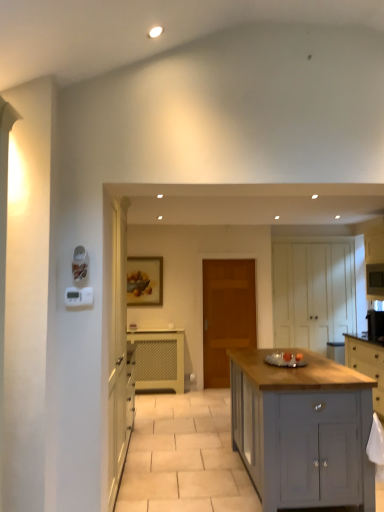
The image size is (384, 512). Describe the element at coordinates (374, 262) in the screenshot. I see `white matte cabinet at right, which ranks as the third cabinetry in front-to-back order` at that location.

You are a GUI agent. You are given a task and a screenshot of the screen. Output one action in this format:
    pyautogui.click(x=<x>, y=<y>)
    Task: Click on the white matte cabinet at right, the third cabinetry positioned from the back
    This screenshot has width=384, height=512.
    Given the screenshot: What is the action you would take?
    pyautogui.click(x=374, y=262)

Locate an element on the screen. beige mesh radiator at center, the fourth cabinetry from the front is located at coordinates (158, 360).

Consider the image. Measure the distance between light gray wood cabinet at right, the fourth cabinetry in the back-to-front sequence, and camera.

The distance of light gray wood cabinet at right, the fourth cabinetry in the back-to-front sequence, from camera is 4.67 meters.

Measure the distance between point (347, 490) and camera.

2.83 meters.

This screenshot has height=512, width=384. Describe the element at coordinates (375, 280) in the screenshot. I see `white glossy microwave at upper right` at that location.

Identify the location of white matte cabinet at right, which ranks as the third cabinetry in front-to-back order. (374, 262).

Does white matte cabinet at right, the fifth cabinetry in the left-to-right sequence, touch beige mesh radiator at center, the fifth cabinetry positioned from the right?

No.

Is white matte cabinet at right, which ranks as the 1th cabinetry in right-to-left order, positioned before beige mesh radiator at center, the fourth cabinetry from the front?

Yes, the depth of white matte cabinet at right, which ranks as the 1th cabinetry in right-to-left order, is less than that of beige mesh radiator at center, the fourth cabinetry from the front.

In the scene shown: Who is taller, white matte cabinet at right, the third cabinetry positioned from the back, or beige mesh radiator at center, which is the 2th cabinetry in back-to-front order?

With more height is white matte cabinet at right, the third cabinetry positioned from the back.

From a real-world perspective, which object rests below the other?

From a 3D spatial view, beige mesh radiator at center, the fifth cabinetry positioned from the right, is below.

Do you think white matte cabinet at right, which ranks as the 1th cabinetry in right-to-left order, is within matte gray cabinet at center, which is counted as the first cabinetry, starting from the front, or outside of it?

white matte cabinet at right, which ranks as the 1th cabinetry in right-to-left order, lies outside matte gray cabinet at center, which is counted as the first cabinetry, starting from the front.

Can you confirm if white matte cabinet at right, the third cabinetry positioned from the back, is shorter than matte gray cabinet at center, the 2th cabinetry when ordered from left to right?

In fact, white matte cabinet at right, the third cabinetry positioned from the back, may be taller than matte gray cabinet at center, the 2th cabinetry when ordered from left to right.

Considering the points (381, 247) and (256, 423), which point is in front, point (381, 247) or point (256, 423)?

The point (256, 423) is closer.

Is beige mesh radiator at center, the fourth cabinetry from the front, facing towards white wood cabinet at center, marked as the third cabinetry in a right-to-left arrangement?

No, beige mesh radiator at center, the fourth cabinetry from the front, is not oriented towards white wood cabinet at center, marked as the third cabinetry in a right-to-left arrangement.

Considering the relative sizes of beige mesh radiator at center, the fifth cabinetry positioned from the right, and white wood cabinet at center, arranged as the fifth cabinetry when viewed from the front, in the image provided, is beige mesh radiator at center, the fifth cabinetry positioned from the right, thinner than white wood cabinet at center, arranged as the fifth cabinetry when viewed from the front,?

Yes, beige mesh radiator at center, the fifth cabinetry positioned from the right, is thinner than white wood cabinet at center, arranged as the fifth cabinetry when viewed from the front.

Is beige mesh radiator at center, the fourth cabinetry from the front, inside the boundaries of white wood cabinet at center, marked as the third cabinetry in a right-to-left arrangement, or outside?

beige mesh radiator at center, the fourth cabinetry from the front, is spatially situated outside white wood cabinet at center, marked as the third cabinetry in a right-to-left arrangement.

Is beige mesh radiator at center, the fifth cabinetry positioned from the right, next to white wood cabinet at center, which is the 3th cabinetry from left to right?

No, beige mesh radiator at center, the fifth cabinetry positioned from the right, is not with white wood cabinet at center, which is the 3th cabinetry from left to right.

Can you tell me how much light gray wood cabinet at right, which is the fourth cabinetry from left to right, and wooden door at center differ in facing direction?

There is a 88.8-degree angle between the facing directions of light gray wood cabinet at right, which is the fourth cabinetry from left to right, and wooden door at center.

Considering the sizes of objects light gray wood cabinet at right, the 2th cabinetry positioned from the right, and wooden door at center in the image provided, who is shorter, light gray wood cabinet at right, the 2th cabinetry positioned from the right, or wooden door at center?

light gray wood cabinet at right, the 2th cabinetry positioned from the right.

Which is nearer, (376, 370) or (210, 300)?

The point (376, 370) is more forward.

Is light gray wood cabinet at right, placed as the second cabinetry when sorted from front to back, oriented away from wooden door at center?

That's not correct — light gray wood cabinet at right, placed as the second cabinetry when sorted from front to back, is not looking away from wooden door at center.

Is white wood cabinet at center, marked as the third cabinetry in a right-to-left arrangement, thinner than wooden door at center?

No, white wood cabinet at center, marked as the third cabinetry in a right-to-left arrangement, is not thinner than wooden door at center.

Locate an element on the screen. This screenshot has width=384, height=512. the 1st cabinetry positioned above the wooden door at center (from a real-world perspective) is located at coordinates (312, 294).

Are white wood cabinet at center, the first cabinetry in the back-to-front sequence, and wooden door at center located far from each other?

That's not correct — white wood cabinet at center, the first cabinetry in the back-to-front sequence, is a little close to wooden door at center.

Consider the image. From the image's perspective, which is below, white wood cabinet at center, marked as the third cabinetry in a right-to-left arrangement, or wooden door at center?

wooden door at center is shown below in the image.

From a real-world perspective, is wooden door at center located higher than white wood cabinet at center, which is the 3th cabinetry from left to right?

No, from a real-world perspective, wooden door at center is not over white wood cabinet at center, which is the 3th cabinetry from left to right

Does wooden door at center appear on the right side of white wood cabinet at center, which is the 3th cabinetry from left to right?

Incorrect, wooden door at center is not on the right side of white wood cabinet at center, which is the 3th cabinetry from left to right.

This screenshot has height=512, width=384. Identify the location of cabinetry behind the wooden door at center. (312, 294).

Is wooden door at center thinner than white wood cabinet at center, marked as the third cabinetry in a right-to-left arrangement?

Indeed, wooden door at center has a lesser width compared to white wood cabinet at center, marked as the third cabinetry in a right-to-left arrangement.

Is white wood cabinet at center, the first cabinetry in the back-to-front sequence, aimed at white glossy microwave at upper right?

Yes.

How far apart are white wood cabinet at center, arranged as the fifth cabinetry when viewed from the front, and white glossy microwave at upper right?

The distance of white wood cabinet at center, arranged as the fifth cabinetry when viewed from the front, from white glossy microwave at upper right is 30.36 inches.

Considering the sizes of objects white wood cabinet at center, arranged as the fifth cabinetry when viewed from the front, and white glossy microwave at upper right in the image provided, who is wider, white wood cabinet at center, arranged as the fifth cabinetry when viewed from the front, or white glossy microwave at upper right?

white wood cabinet at center, arranged as the fifth cabinetry when viewed from the front.

Can you tell me how much white wood cabinet at center, marked as the third cabinetry in a right-to-left arrangement, and white glossy microwave at upper right differ in facing direction?

There is a 89.4-degree angle between the facing directions of white wood cabinet at center, marked as the third cabinetry in a right-to-left arrangement, and white glossy microwave at upper right.

At what (x,y) coordinates should I click in order to perform the action: click on cabinetry that is the 4th object located above the beige mesh radiator at center, positioned as the 1th cabinetry in left-to-right order (from the image's perspective). Please return your answer as a coordinate pair (x, y). Looking at the image, I should click on (374, 262).

From the white matte cabinet at right, the third cabinetry positioned from the back, count the 3rd cabinetry to the left and point to it. Please provide its 2D coordinates.

[(302, 431)]

Consider the image. Which object lies nearer to the anchor point light gray wood cabinet at right, the 2th cabinetry positioned from the right, white glossy microwave at upper right or wooden door at center?

Based on the image, white glossy microwave at upper right appears to be nearer to light gray wood cabinet at right, the 2th cabinetry positioned from the right.

Which object lies nearer to the anchor point light gray wood cabinet at right, the fourth cabinetry in the back-to-front sequence, wooden door at center or matte gray cabinet at center, the 2th cabinetry when ordered from left to right?

The object closer to light gray wood cabinet at right, the fourth cabinetry in the back-to-front sequence, is wooden door at center.

From the image, which object appears to be nearer to matte gray cabinet at center, placed as the fifth cabinetry when sorted from back to front, wooden door at center or white matte cabinet at right, the fifth cabinetry in the left-to-right sequence?

The object closer to matte gray cabinet at center, placed as the fifth cabinetry when sorted from back to front, is wooden door at center.

Based on their spatial positions, is beige mesh radiator at center, positioned as the 1th cabinetry in left-to-right order, or light gray wood cabinet at right, which is the fourth cabinetry from left to right, closer to white glossy microwave at upper right?

light gray wood cabinet at right, which is the fourth cabinetry from left to right, lies closer to white glossy microwave at upper right than the other object.

When comparing their distances from beige mesh radiator at center, the fifth cabinetry positioned from the right, does white wood cabinet at center, the first cabinetry in the back-to-front sequence, or light gray wood cabinet at right, the fourth cabinetry in the back-to-front sequence, seem closer?

Among the two, white wood cabinet at center, the first cabinetry in the back-to-front sequence, is located nearer to beige mesh radiator at center, the fifth cabinetry positioned from the right.

When comparing their distances from white matte cabinet at right, which ranks as the 1th cabinetry in right-to-left order, does wooden door at center or light gray wood cabinet at right, placed as the second cabinetry when sorted from front to back, seem closer?

Based on the image, light gray wood cabinet at right, placed as the second cabinetry when sorted from front to back, appears to be nearer to white matte cabinet at right, which ranks as the 1th cabinetry in right-to-left order.

Looking at the image, which one is located closer to white wood cabinet at center, which is the 3th cabinetry from left to right, white matte cabinet at right, the fifth cabinetry in the left-to-right sequence, or light gray wood cabinet at right, which is the fourth cabinetry from left to right?

white matte cabinet at right, the fifth cabinetry in the left-to-right sequence, is positioned closer to the anchor white wood cabinet at center, which is the 3th cabinetry from left to right.

Considering their positions, is white matte cabinet at right, the fifth cabinetry in the left-to-right sequence, positioned closer to white glossy microwave at upper right than wooden door at center?

white matte cabinet at right, the fifth cabinetry in the left-to-right sequence, is positioned closer to the anchor white glossy microwave at upper right.

This screenshot has width=384, height=512. I want to click on appliance between matte gray cabinet at center, placed as the fifth cabinetry when sorted from back to front, and wooden door at center in the front-back direction, so click(375, 280).

I want to click on appliance positioned between matte gray cabinet at center, placed as the fifth cabinetry when sorted from back to front, and white wood cabinet at center, which is the 3th cabinetry from left to right, from near to far, so click(375, 280).

Where is `appliance between white matte cabinet at right, the fifth cabinetry in the left-to-right sequence, and white wood cabinet at center, marked as the third cabinetry in a right-to-left arrangement, in the front-back direction`? This screenshot has height=512, width=384. appliance between white matte cabinet at right, the fifth cabinetry in the left-to-right sequence, and white wood cabinet at center, marked as the third cabinetry in a right-to-left arrangement, in the front-back direction is located at coordinates (375, 280).

Find the location of `appliance between matte gray cabinet at center, placed as the fifth cabinetry when sorted from back to front, and beige mesh radiator at center, the fifth cabinetry positioned from the right, in the front-back direction`. appliance between matte gray cabinet at center, placed as the fifth cabinetry when sorted from back to front, and beige mesh radiator at center, the fifth cabinetry positioned from the right, in the front-back direction is located at coordinates (375, 280).